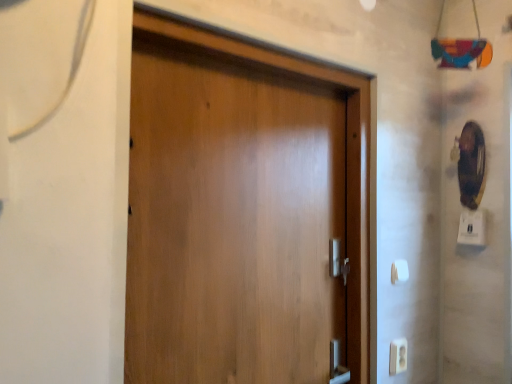
Question: Is white plastic electric outlet at lower right facing away from white plastic light switch at right, which appears as the 2th light switch when viewed from the left?

Choices:
 (A) yes
 (B) no

Answer: (B)

Question: Is white plastic electric outlet at lower right touching white plastic light switch at right, which appears as the 2th light switch when viewed from the left?

Choices:
 (A) yes
 (B) no

Answer: (B)

Question: Is white plastic electric outlet at lower right closer to the viewer compared to white plastic light switch at right, arranged as the 1th light switch when viewed from the top?

Choices:
 (A) yes
 (B) no

Answer: (A)

Question: Is white plastic electric outlet at lower right further to camera compared to white plastic light switch at right, which appears as the 2th light switch when viewed from the left?

Choices:
 (A) yes
 (B) no

Answer: (B)

Question: From the image's perspective, would you say white plastic electric outlet at lower right is positioned over white plastic light switch at right, which appears as the 2th light switch when viewed from the left?

Choices:
 (A) yes
 (B) no

Answer: (B)

Question: Is white plastic electric outlet at lower right positioned far away from white plastic light switch at right, which ranks as the 2th light switch in bottom-to-top order?

Choices:
 (A) yes
 (B) no

Answer: (B)

Question: Does white plastic light switch at lower right, marked as the 2th light switch in a top-to-bottom arrangement, have a smaller size compared to wooden door at center?

Choices:
 (A) no
 (B) yes

Answer: (B)

Question: Is white plastic light switch at lower right, positioned as the 1th light switch in bottom-to-top order, surrounding wooden door at center?

Choices:
 (A) no
 (B) yes

Answer: (A)

Question: Can you confirm if white plastic light switch at lower right, marked as the 2th light switch in a top-to-bottom arrangement, is taller than wooden door at center?

Choices:
 (A) yes
 (B) no

Answer: (B)

Question: Does white plastic light switch at lower right, marked as the 2th light switch in a top-to-bottom arrangement, appear on the left side of wooden door at center?

Choices:
 (A) no
 (B) yes

Answer: (A)

Question: Is white plastic light switch at lower right, marked as the 1th light switch in a left-to-right arrangement, shorter than wooden door at center?

Choices:
 (A) yes
 (B) no

Answer: (A)

Question: Is white plastic light switch at lower right, marked as the 1th light switch in a left-to-right arrangement, beside wooden door at center?

Choices:
 (A) yes
 (B) no

Answer: (B)

Question: Considering the relative positions of white plastic light switch at right, which appears as the 2th light switch when viewed from the left, and white plastic light switch at lower right, marked as the 1th light switch in a left-to-right arrangement, in the image provided, is white plastic light switch at right, which appears as the 2th light switch when viewed from the left, to the left of white plastic light switch at lower right, marked as the 1th light switch in a left-to-right arrangement, from the viewer's perspective?

Choices:
 (A) yes
 (B) no

Answer: (B)